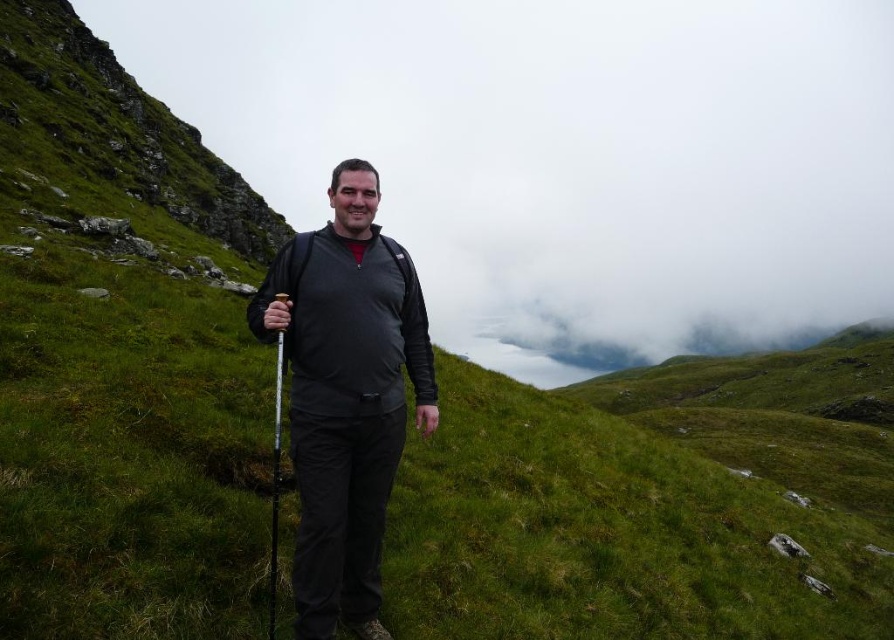
Question: Among these objects, which one is nearest to the camera?

Choices:
 (A) white plastic ski pole at center
 (B) matte black jacket at center

Answer: (A)

Question: Which point appears closest to the camera in this image?

Choices:
 (A) (275, 346)
 (B) (429, 426)

Answer: (B)

Question: Which point is farther to the camera?

Choices:
 (A) matte black jacket at center
 (B) white plastic ski pole at center

Answer: (A)

Question: Is matte black jacket at center to the left of white plastic ski pole at center from the viewer's perspective?

Choices:
 (A) no
 (B) yes

Answer: (B)

Question: Is the position of matte black jacket at center less distant than that of white plastic ski pole at center?

Choices:
 (A) yes
 (B) no

Answer: (B)

Question: Considering the relative positions of matte black jacket at center and white plastic ski pole at center in the image provided, where is matte black jacket at center located with respect to white plastic ski pole at center?

Choices:
 (A) left
 (B) right

Answer: (A)